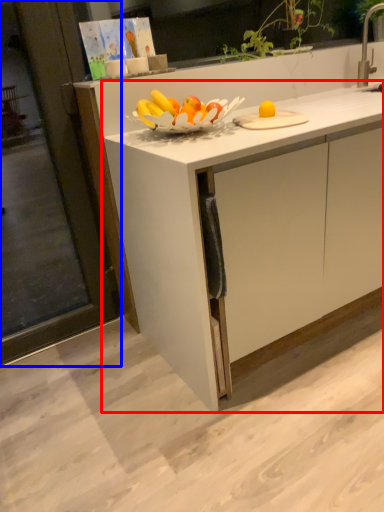
Question: Which of the following is the closest to the observer, cabinetry (highlighted by a red box) or screen door (highlighted by a blue box)?

Choices:
 (A) cabinetry
 (B) screen door

Answer: (A)